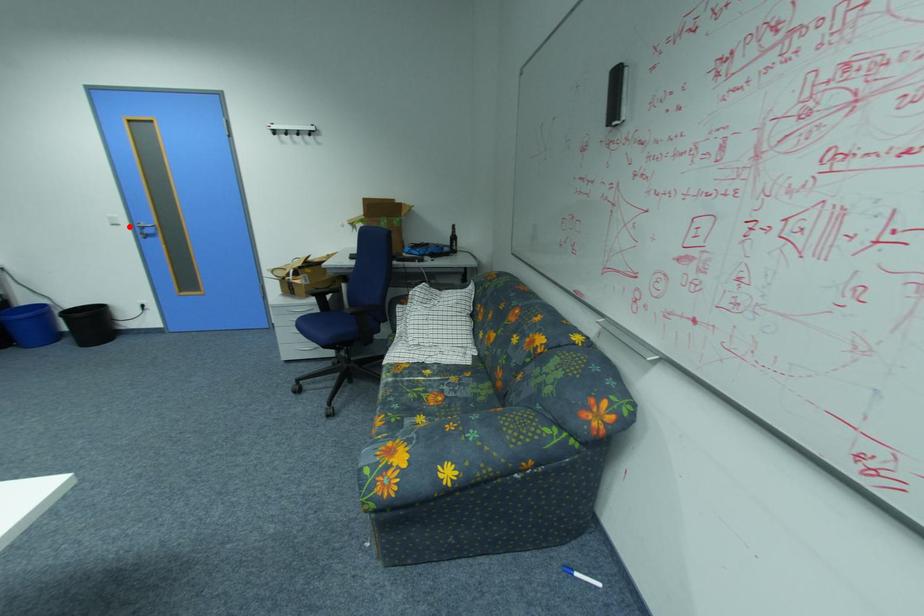
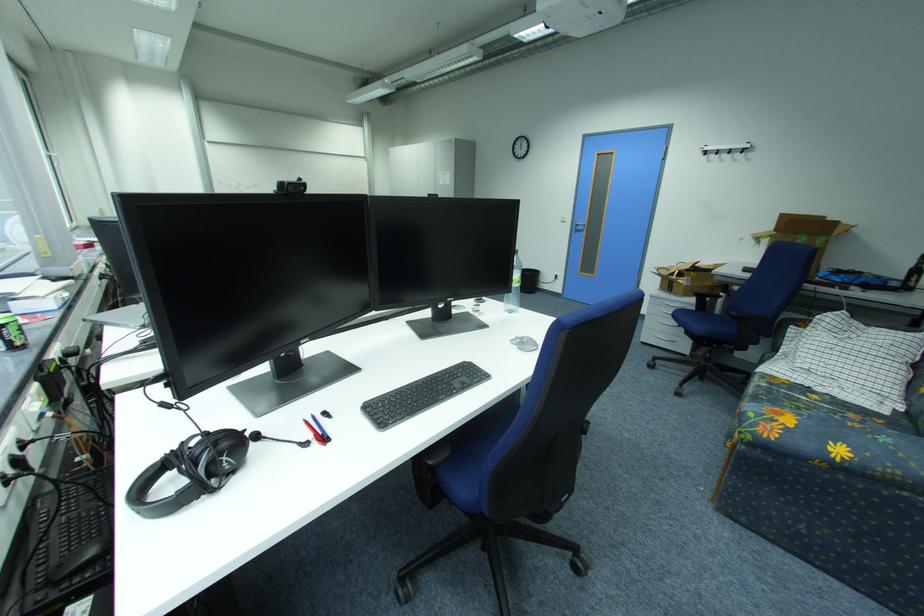
Find the pixel in the second image that matches the highlighted location in the first image.

(574, 223)